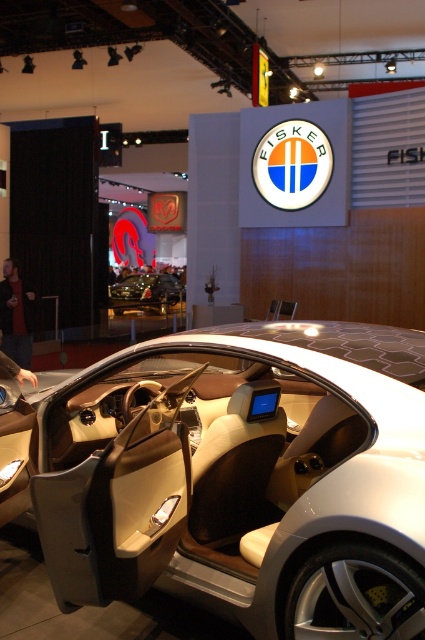
Question: Does shiny black car at center appear over dark gray jacket at lower left?

Choices:
 (A) no
 (B) yes

Answer: (B)

Question: Based on their relative distances, which object is farther from the matte beige interior at center?

Choices:
 (A) shiny black car at center
 (B) black leather jacket at lower left
 (C) dark gray jacket at lower left

Answer: (A)

Question: Observing the image, what is the correct spatial positioning of black leather jacket at lower left in reference to dark gray jacket at lower left?

Choices:
 (A) left
 (B) right

Answer: (A)

Question: Which point is farther to the camera?

Choices:
 (A) black leather jacket at lower left
 (B) matte beige interior at center

Answer: (A)

Question: Which point is farther to the camera?

Choices:
 (A) matte beige interior at center
 (B) black leather jacket at lower left
 (C) shiny black car at center
 (D) dark gray jacket at lower left

Answer: (C)

Question: Does matte beige interior at center have a greater width compared to shiny black car at center?

Choices:
 (A) yes
 (B) no

Answer: (B)